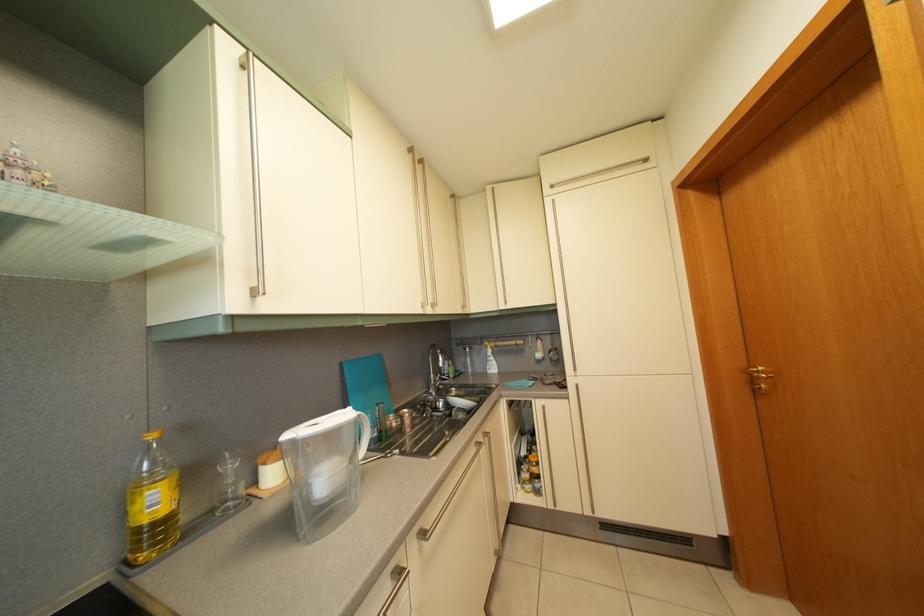
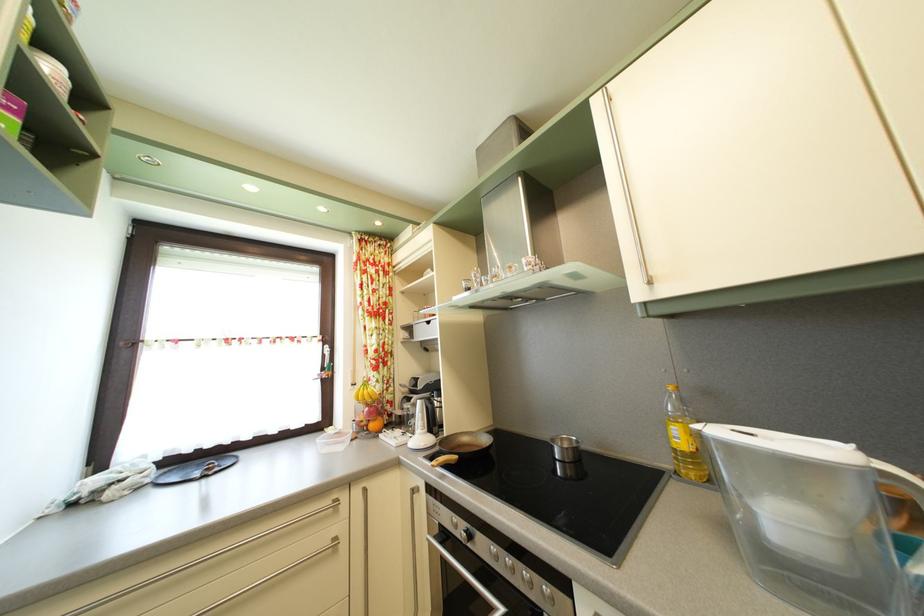
The point at (195,436) is marked in the first image. Where is the corresponding point in the second image?

(715, 400)